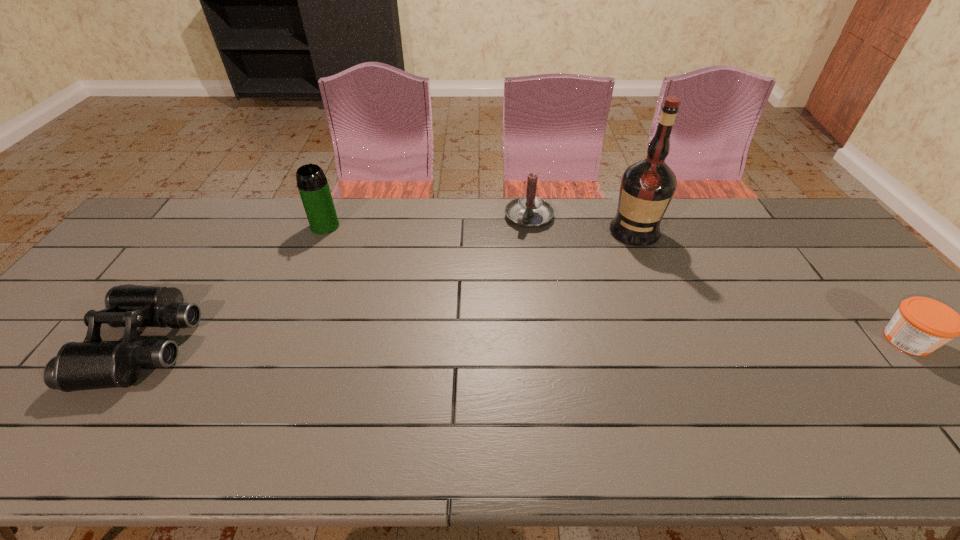
Image resolution: width=960 pixels, height=540 pixels. Find the location of `free spot on the desktop that is between the leftmost object and the rightmost object and is positioned from the spout of the second tallest object`. free spot on the desktop that is between the leftmost object and the rightmost object and is positioned from the spout of the second tallest object is located at coordinates (444, 342).

This screenshot has height=540, width=960. I want to click on free space on the desktop that is between the binoculars and the rightmost object and is positioned on the surface of the tallest object, so click(608, 342).

Locate an element on the screen. vacant space on the desktop that is between the leftmost object and the shortest object and is positioned on the side of the third object from left to right with the handle loop is located at coordinates (454, 342).